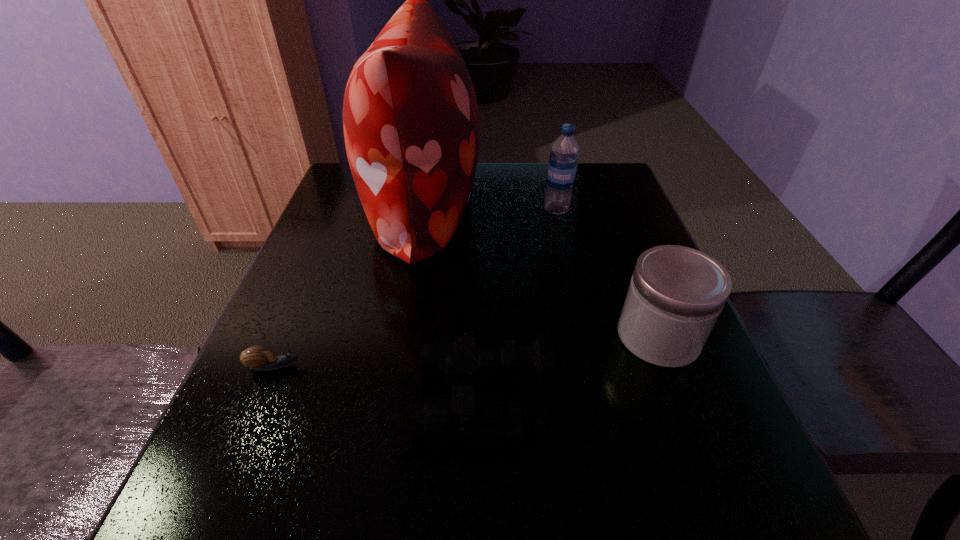
I want to click on free space in the image that satisfies the following two spatial constraints: 1. on the front-facing side of the tallest object; 2. on the left side of the jar, so click(x=400, y=336).